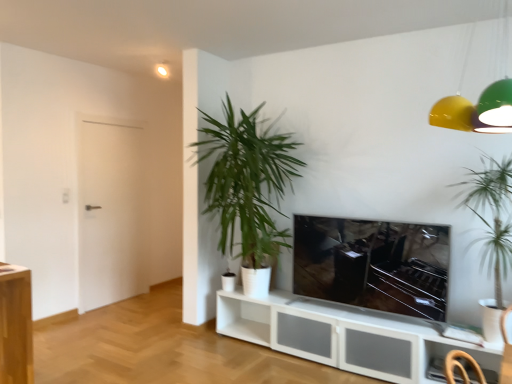
Based on the photo, measure the distance between point (x=355, y=234) and camera.

Point (x=355, y=234) and camera are 3.41 meters apart from each other.

What do you see at coordinates (247, 180) in the screenshot?
I see `green leafy plant at center, the 2th houseplant when ordered from front to back` at bounding box center [247, 180].

Locate an element on the screen. This screenshot has width=512, height=384. matte black tv at center is located at coordinates (373, 264).

Which is more to the right, matte black tv at center or white matte door at left?

Positioned to the right is matte black tv at center.

From the image's perspective, is matte black tv at center below white matte door at left?

Correct, matte black tv at center appears lower than white matte door at left in the image.

Which object is more forward, matte black tv at center or white matte door at left?

matte black tv at center is closer to the camera.

Looking at this image, from a real-world perspective, which object stands above the other?

From a 3D spatial view, yellow matte lampshade at upper right is above.

Between matte black tv at center and yellow matte lampshade at upper right, which one has smaller size?

Smaller between the two is matte black tv at center.

Find the location of a particular element. This screenshot has width=512, height=384. lamp above the matte black tv at center (from the image's perspective) is located at coordinates (480, 101).

Which object is closer to the camera taking this photo, matte black tv at center or yellow matte lampshade at upper right?

yellow matte lampshade at upper right.

In the scene shown: From a real-world perspective, between white matte door at left and yellow matte lampshade at upper right, who is vertically higher?

yellow matte lampshade at upper right is physically above.

Considering the relative sizes of white matte door at left and yellow matte lampshade at upper right in the image provided, is white matte door at left taller than yellow matte lampshade at upper right?

Indeed, white matte door at left has a greater height compared to yellow matte lampshade at upper right.

Would you say white matte door at left is outside yellow matte lampshade at upper right?

Yes.

Can you confirm if white matte door at left is wider than yellow matte lampshade at upper right?

No.

What's the angular difference between green leafy plant at center, marked as the first houseplant in a back-to-front arrangement, and matte black tv at center's facing directions?

They differ by 0.0624 degrees in their facing directions.

Considering the relative positions of green leafy plant at center, the 2th houseplant viewed from the right, and matte black tv at center in the image provided, is green leafy plant at center, the 2th houseplant viewed from the right, to the left or to the right of matte black tv at center?

In the image, green leafy plant at center, the 2th houseplant viewed from the right, appears on the left side of matte black tv at center.

Is green leafy plant at center, marked as the first houseplant in a back-to-front arrangement, positioned behind matte black tv at center?

Yes, green leafy plant at center, marked as the first houseplant in a back-to-front arrangement, is further from the camera.

Does point (214, 175) come behind point (350, 279)?

Yes, point (214, 175) is farther from viewer.

Can you confirm if green leafy plant at right, the second houseplant positioned from the back, is shorter than white matte door at left?

Correct, green leafy plant at right, the second houseplant positioned from the back, is not as tall as white matte door at left.

Considering the relative sizes of green leafy plant at right, acting as the second houseplant starting from the left, and white matte door at left in the image provided, is green leafy plant at right, acting as the second houseplant starting from the left, bigger than white matte door at left?

Yes, green leafy plant at right, acting as the second houseplant starting from the left, is bigger than white matte door at left.

Is green leafy plant at right, acting as the second houseplant starting from the left, next to white matte door at left?

green leafy plant at right, acting as the second houseplant starting from the left, is not next to white matte door at left, and they're not touching.

Considering their positions, is green leafy plant at right, the 1th houseplant in the right-to-left sequence, located in front of or behind white matte door at left?

Clearly, green leafy plant at right, the 1th houseplant in the right-to-left sequence, is in front of white matte door at left.

Consider the image. Does green leafy plant at center, the 2th houseplant when ordered from front to back, have a larger size compared to green leafy plant at right, the 1th houseplant in the right-to-left sequence?

Yes, green leafy plant at center, the 2th houseplant when ordered from front to back, is bigger than green leafy plant at right, the 1th houseplant in the right-to-left sequence.

In the image, there is a green leafy plant at center, marked as the first houseplant in a back-to-front arrangement. At what (x,y) coordinates should I click in order to perform the action: click on houseplant below it (from the image's perspective). Please return your answer as a coordinate pair (x, y). The height and width of the screenshot is (384, 512). Looking at the image, I should click on (492, 230).

Could you measure the distance between green leafy plant at center, the 2th houseplant when ordered from front to back, and green leafy plant at right, arranged as the first houseplant when viewed from the front?

They are 1.67 meters apart.

Considering the relative sizes of green leafy plant at center, the 2th houseplant when ordered from front to back, and green leafy plant at right, the second houseplant positioned from the back, in the image provided, is green leafy plant at center, the 2th houseplant when ordered from front to back, shorter than green leafy plant at right, the second houseplant positioned from the back,?

No, green leafy plant at center, the 2th houseplant when ordered from front to back, is not shorter than green leafy plant at right, the second houseplant positioned from the back.

Considering the sizes of objects matte black tv at center and green leafy plant at right, acting as the second houseplant starting from the left, in the image provided, who is thinner, matte black tv at center or green leafy plant at right, acting as the second houseplant starting from the left,?

matte black tv at center is thinner.

Which of these two, matte black tv at center or green leafy plant at right, the 1th houseplant in the right-to-left sequence, stands taller?

green leafy plant at right, the 1th houseplant in the right-to-left sequence, is taller.

Which object is closer to the camera taking this photo, matte black tv at center or green leafy plant at right, the 1th houseplant in the right-to-left sequence?

green leafy plant at right, the 1th houseplant in the right-to-left sequence, is in front.

From the image's perspective, which is below, matte black tv at center or green leafy plant at right, acting as the second houseplant starting from the left?

→ From the image's view, matte black tv at center is below.

Image resolution: width=512 pixels, height=384 pixels. I want to click on door above the matte black tv at center (from the image's perspective), so click(110, 213).

Where is `television located behind the yellow matte lampshade at upper right`? television located behind the yellow matte lampshade at upper right is located at coordinates (373, 264).

Which object lies nearer to the anchor point matte black tv at center, white matte door at left or yellow matte lampshade at upper right?

yellow matte lampshade at upper right.

Estimate the real-world distances between objects in this image. Which object is further from matte black tv at center, green leafy plant at right, the 1th houseplant in the right-to-left sequence, or white matte door at left?

white matte door at left is positioned further to the anchor matte black tv at center.

Based on their spatial positions, is matte black tv at center or green leafy plant at center, which appears as the first houseplant when viewed from the left, further from yellow matte lampshade at upper right?

green leafy plant at center, which appears as the first houseplant when viewed from the left, is further to yellow matte lampshade at upper right.

Which object lies further to the anchor point matte black tv at center, yellow matte lampshade at upper right or green leafy plant at center, the 2th houseplant viewed from the right?

yellow matte lampshade at upper right is further to matte black tv at center.

Looking at the image, which one is located closer to green leafy plant at center, the 2th houseplant when ordered from front to back, matte black tv at center or green leafy plant at right, the 1th houseplant in the right-to-left sequence?

Among the two, matte black tv at center is located nearer to green leafy plant at center, the 2th houseplant when ordered from front to back.

Looking at the image, which one is located further to yellow matte lampshade at upper right, green leafy plant at center, which appears as the first houseplant when viewed from the left, or white matte door at left?

white matte door at left.

From the image, which object appears to be nearer to white matte door at left, green leafy plant at right, the second houseplant positioned from the back, or matte black tv at center?

matte black tv at center.

Estimate the real-world distances between objects in this image. Which object is closer to matte black tv at center, white matte door at left or green leafy plant at center, the 2th houseplant when ordered from front to back?

green leafy plant at center, the 2th houseplant when ordered from front to back, is closer to matte black tv at center.

The image size is (512, 384). Find the location of `lamp between green leafy plant at center, which appears as the first houseplant when viewed from the left, and green leafy plant at right, the 1th houseplant in the right-to-left sequence, from left to right`. lamp between green leafy plant at center, which appears as the first houseplant when viewed from the left, and green leafy plant at right, the 1th houseplant in the right-to-left sequence, from left to right is located at coordinates (480, 101).

Identify the location of houseplant between white matte door at left and matte black tv at center from left to right. (247, 180).

This screenshot has width=512, height=384. What are the coordinates of `lamp located between white matte door at left and green leafy plant at right, the 1th houseplant in the right-to-left sequence, in the left-right direction` in the screenshot? It's located at (480, 101).

Identify the location of television located between white matte door at left and green leafy plant at right, the 1th houseplant in the right-to-left sequence, in the left-right direction. (373, 264).